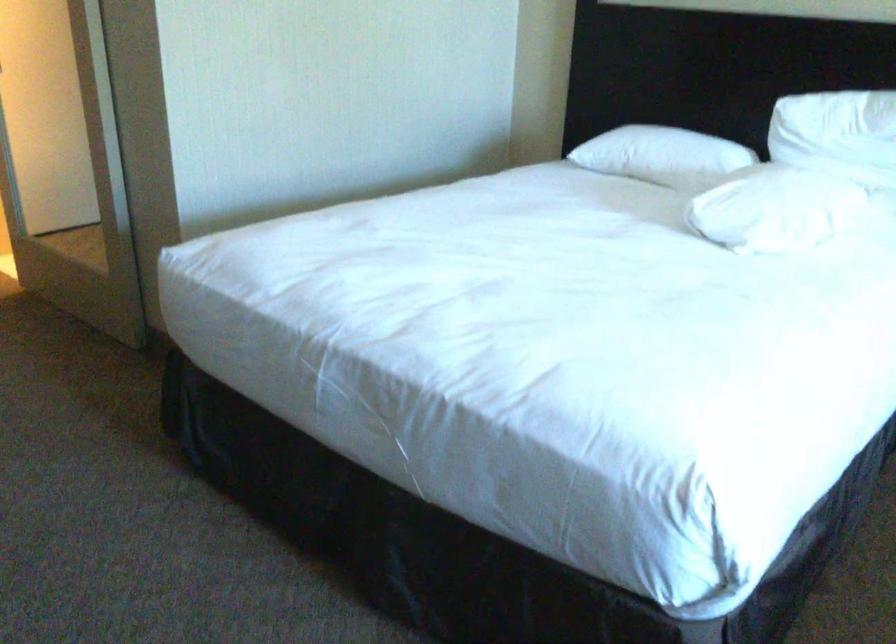
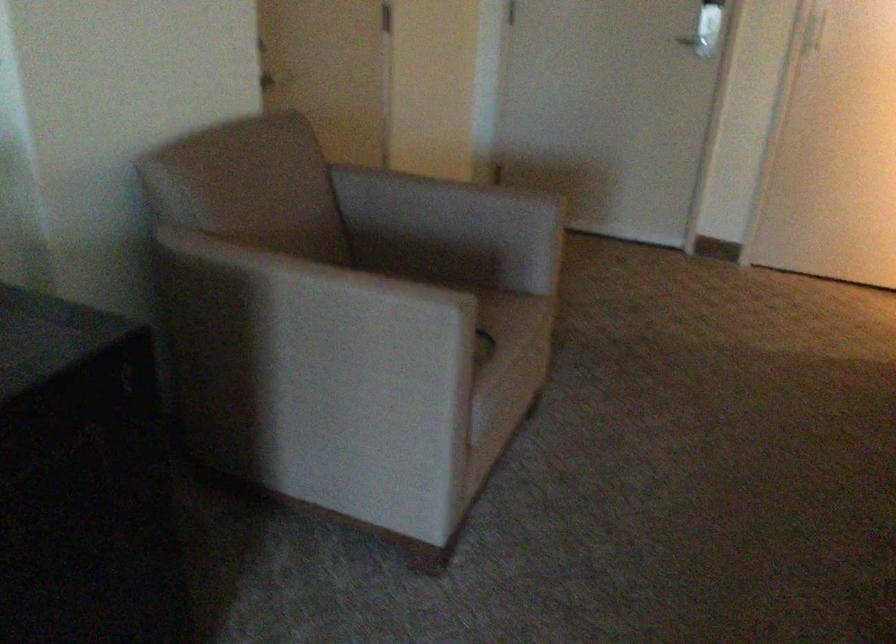
Question: The camera is either moving clockwise (left) or counter-clockwise (right) around the object. The first image is from the beginning of the video and the second image is from the end. Is the camera moving left or right when shooting the video?

Choices:
 (A) Left
 (B) Right

Answer: (B)